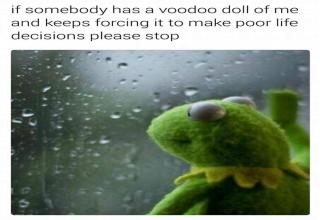
The image size is (320, 220). I want to click on glass, so pos(130,132).